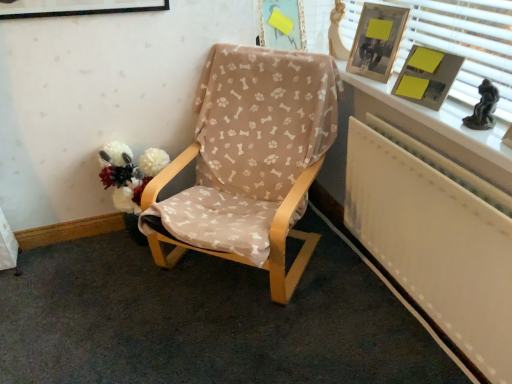
Question: Is white painted wood at upper right inside yellow paper at upper right?

Choices:
 (A) yes
 (B) no

Answer: (B)

Question: Is yellow paper at upper right not near white painted wood at upper right?

Choices:
 (A) yes
 (B) no

Answer: (B)

Question: From the image's perspective, is yellow paper at upper right beneath white painted wood at upper right?

Choices:
 (A) yes
 (B) no

Answer: (A)

Question: Is the depth of yellow paper at upper right less than that of white painted wood at upper right?

Choices:
 (A) no
 (B) yes

Answer: (A)

Question: Considering the relative sizes of yellow paper at upper right and white painted wood at upper right in the image provided, is yellow paper at upper right smaller than white painted wood at upper right?

Choices:
 (A) yes
 (B) no

Answer: (A)

Question: From the image's perspective, is beige fabric-covered chair at center located above or below white painted wood at upper right?

Choices:
 (A) below
 (B) above

Answer: (A)

Question: Is beige fabric-covered chair at center in front of or behind white painted wood at upper right in the image?

Choices:
 (A) behind
 (B) front

Answer: (A)

Question: Is point (225, 167) closer or farther from the camera than point (480, 46)?

Choices:
 (A) farther
 (B) closer

Answer: (A)

Question: Considering the relative positions of beige fabric-covered chair at center and white painted wood at upper right in the image provided, is beige fabric-covered chair at center to the left or to the right of white painted wood at upper right?

Choices:
 (A) right
 (B) left

Answer: (B)

Question: Does point (443, 41) appear closer or farther from the camera than point (285, 9)?

Choices:
 (A) closer
 (B) farther

Answer: (A)

Question: From a real-world perspective, is white painted wood at upper right above or below matte plastic picture frame at upper center, acting as the 2th picture frame starting from the right?

Choices:
 (A) above
 (B) below

Answer: (A)

Question: Is white painted wood at upper right situated inside matte plastic picture frame at upper center, positioned as the 1th picture frame in left-to-right order, or outside?

Choices:
 (A) inside
 (B) outside

Answer: (B)

Question: Considering the positions of white painted wood at upper right and matte plastic picture frame at upper center, acting as the 2th picture frame starting from the right, in the image, is white painted wood at upper right taller or shorter than matte plastic picture frame at upper center, acting as the 2th picture frame starting from the right,?

Choices:
 (A) tall
 (B) short

Answer: (A)

Question: Is point (261, 36) positioned closer to the camera than point (502, 51)?

Choices:
 (A) closer
 (B) farther

Answer: (B)

Question: Based on their positions, is matte plastic picture frame at upper center, positioned as the 1th picture frame in left-to-right order, located to the left or right of white painted wood at upper right?

Choices:
 (A) right
 (B) left

Answer: (B)